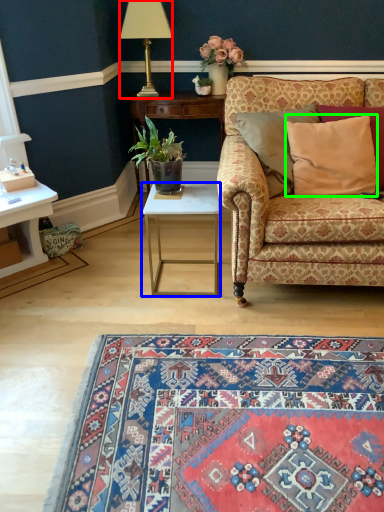
Question: Considering the real-world distances, which object is farthest from lamp (highlighted by a red box)? table (highlighted by a blue box) or pillow (highlighted by a green box)?

Choices:
 (A) table
 (B) pillow

Answer: (B)